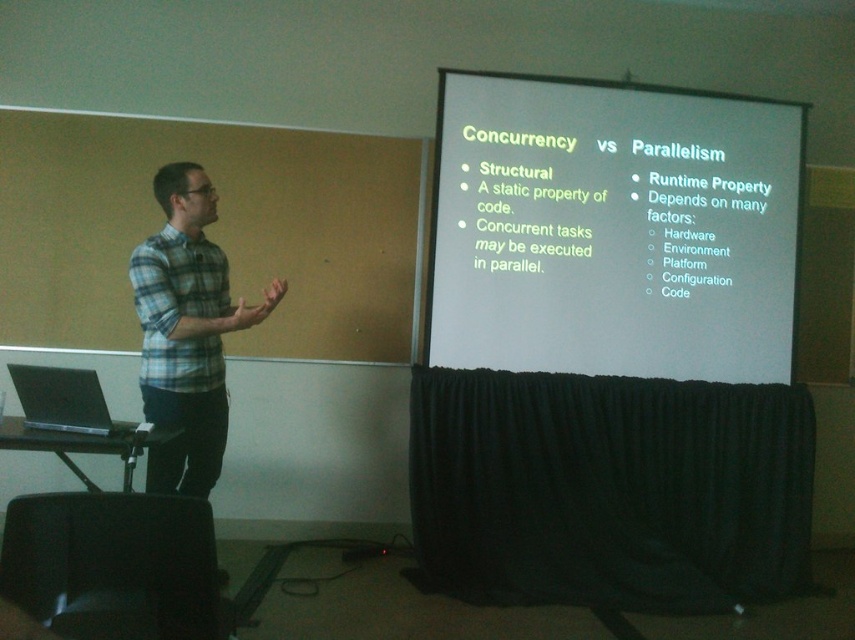
Is point (152, 257) behind point (207, 275)?

That is False.

Locate an element on the screen. blue plaid shirt at left is located at coordinates (186, 332).

Is blue plaid shirt at left taller than matte black laptop at left?

Yes, blue plaid shirt at left is taller than matte black laptop at left.

This screenshot has width=855, height=640. In order to click on blue plaid shirt at left in this screenshot , I will do `click(186, 332)`.

Is point (612, 355) farther from camera compared to point (60, 419)?

That is True.

What do you see at coordinates (612, 228) in the screenshot? The height and width of the screenshot is (640, 855). I see `white matte projector screen at upper center` at bounding box center [612, 228].

The image size is (855, 640). I want to click on white matte projector screen at upper center, so click(612, 228).

What are the coordinates of `white matte projector screen at upper center` in the screenshot? It's located at (612, 228).